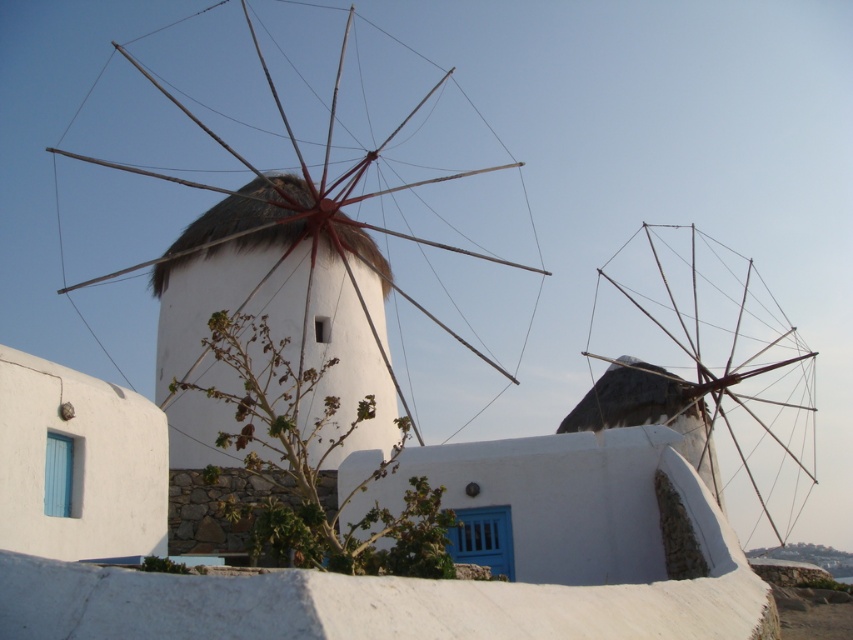
Question: Is white thatched roof windmill at center to the left of wooden windmill at center from the viewer's perspective?

Choices:
 (A) yes
 (B) no

Answer: (A)

Question: Is white thatched roof windmill at center bigger than wooden windmill at center?

Choices:
 (A) yes
 (B) no

Answer: (A)

Question: Which of the following is the closest to the observer?

Choices:
 (A) white thatched roof windmill at center
 (B) wooden windmill at center

Answer: (A)

Question: Does white thatched roof windmill at center have a larger size compared to wooden windmill at center?

Choices:
 (A) no
 (B) yes

Answer: (B)